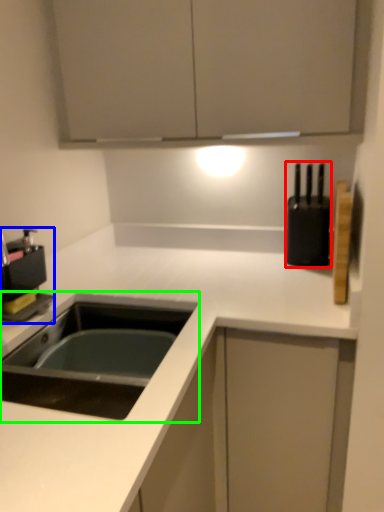
Question: Estimate the real-world distances between objects in this image. Which object is closer to appliance (highlighted by a red box), coffee machine (highlighted by a blue box) or sink (highlighted by a green box)?

Choices:
 (A) coffee machine
 (B) sink

Answer: (B)